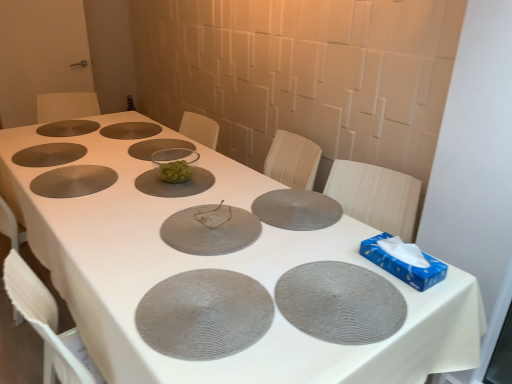
Locate an element on the screen. vacant area that lies between matte gray placemat at left, which appears as the fifth glass plate when viewed from the front, and clear glass bowl at center, marked as the 6th glass plate in a front-to-back arrangement is located at coordinates (113, 181).